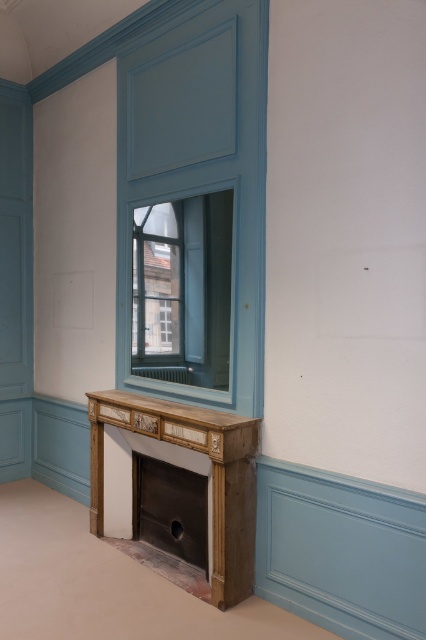
Question: Which object is the closest to the matte glass window at center?

Choices:
 (A) wooden mantel at center
 (B) metallic silver fireplace at lower center
 (C) wooden fireplace at lower center

Answer: (A)

Question: Which point is closer to the camera taking this photo?

Choices:
 (A) (95, 438)
 (B) (117, 408)
 (C) (150, 461)

Answer: (B)

Question: Is wooden fireplace at lower center to the right of wooden mantel at center from the viewer's perspective?

Choices:
 (A) yes
 (B) no

Answer: (A)

Question: Does matte glass window at center come in front of metallic silver fireplace at lower center?

Choices:
 (A) no
 (B) yes

Answer: (B)

Question: Does wooden fireplace at lower center have a smaller size compared to wooden mantel at center?

Choices:
 (A) yes
 (B) no

Answer: (B)

Question: Which point appears closest to the camera in this image?

Choices:
 (A) (135, 396)
 (B) (169, 221)
 (C) (169, 477)
 (D) (204, 444)

Answer: (D)